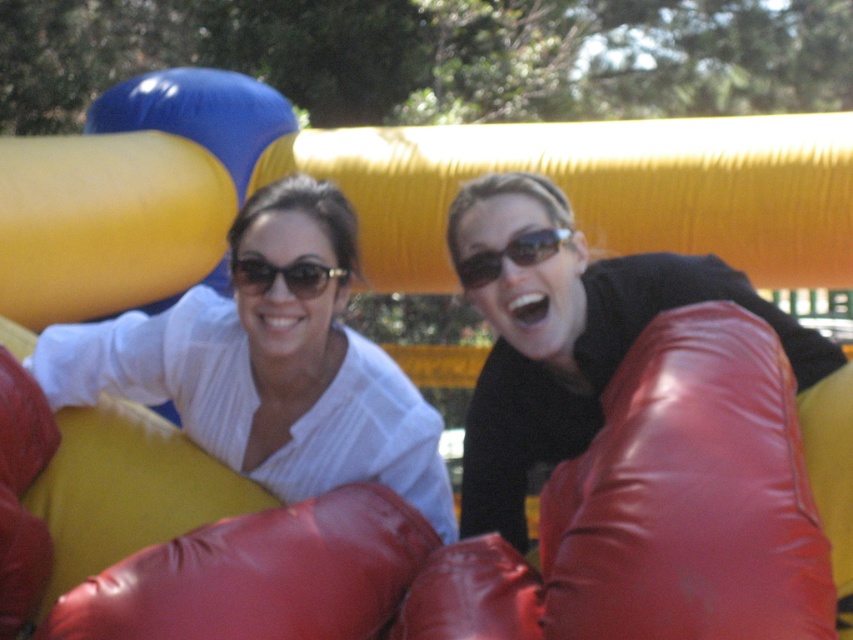
Question: Is rubber boxing glove at lower center to the left of matte black sunglasses at center from the viewer's perspective?

Choices:
 (A) no
 (B) yes

Answer: (A)

Question: Which point is farther from the camera taking this photo?

Choices:
 (A) (669, 412)
 (B) (479, 275)
 (C) (332, 420)
 (D) (335, 272)

Answer: (C)

Question: Is matte red boxing glove at center thinner than matte black sunglasses at center?

Choices:
 (A) yes
 (B) no

Answer: (B)

Question: Estimate the real-world distances between objects in this image. Which object is closer to the matte red boxing glove at center?

Choices:
 (A) rubber-like red boxing glove at right
 (B) matte black sunglasses at center
 (C) rubber boxing glove at lower center

Answer: (C)

Question: Which object is positioned closest to the matte red boxing glove at center?

Choices:
 (A) white striped shirt at upper left
 (B) rubber boxing glove at lower center
 (C) matte black sunglasses at center

Answer: (B)

Question: Is matte black sunglasses at center to the left of sunglasses at center from the viewer's perspective?

Choices:
 (A) no
 (B) yes

Answer: (B)